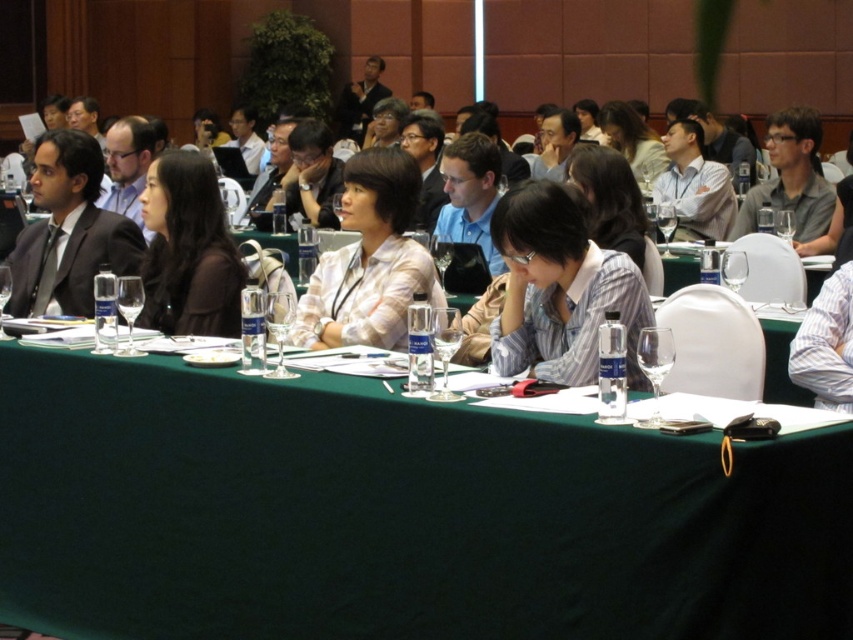
You are organizing a photo shoot and need to arrange two models wearing the white textured shirt at center and the matte gray shirt at upper right. Based on the scene, which shirt is positioned to the left of the other?

The white textured shirt at center is positioned on the left side of matte gray shirt at upper right.

You are an event planner organizing a photo shoot for the conference. You need to place a small decorative item exactly at the point with coordinates point (189, 250). According to the scene description, where should you place the item?

The point (189, 250) is on the matte black shirt at center, so you should place the item on the matte black shirt at center.

You are organizing a photo shoot and need to arrange two shirts for a display. The white textured shirt at center and the matte gray shirt at upper right are available. Based on their positions in the image, which shirt should you place higher to ensure they are aligned vertically?

The white textured shirt at center is shorter than the matte gray shirt at upper right, so to align them vertically, the white textured shirt at center should be placed higher than the matte gray shirt at upper right.